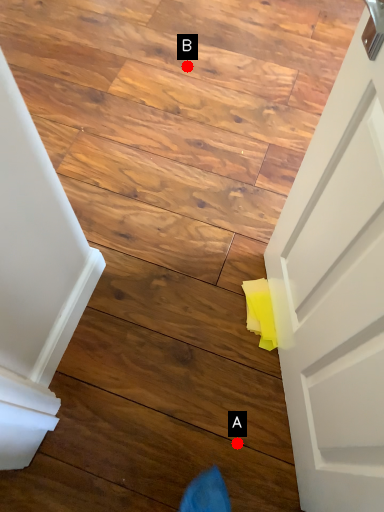
Question: Two points are circled on the image, labeled by A and B beside each circle. Which point is closer to the camera taking this photo?

Choices:
 (A) A is closer
 (B) B is closer

Answer: (A)